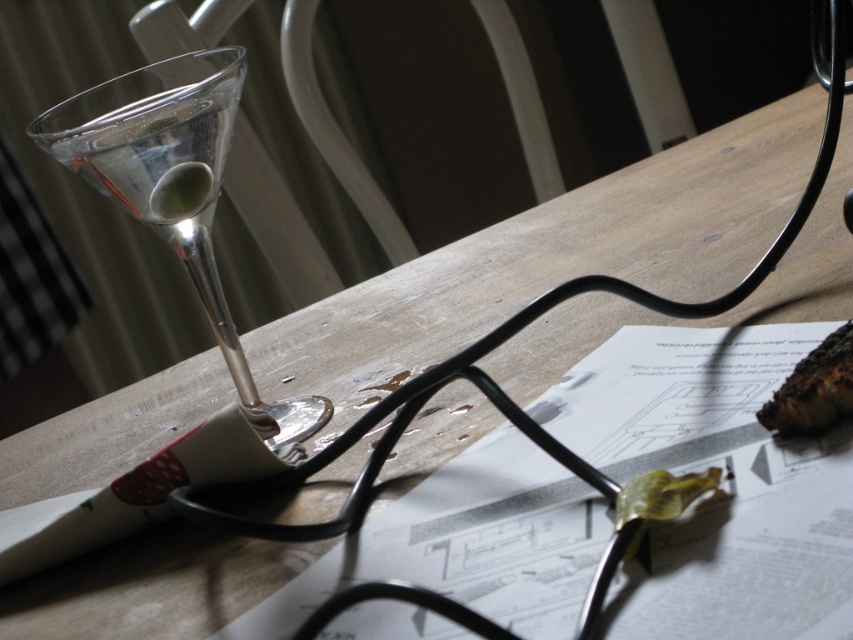
You are a bartender preparing a drink. You have a clear glass martini glass at left and a charcoal black bread at lower right on the table. Which object has a larger diameter?

The clear glass martini glass at left might be wider than charcoal black bread at lower right, so it likely has a larger diameter.

You are organizing items on a wooden table. You need to place a new item between the white paper at center and the charcoal black bread at lower right. Based on their current positions, which object should you place the new item closer to?

The white paper at center is positioned on the left side of charcoal black bread at lower right, so to place the new item between them, you should position it closer to the white paper at center since it is on the left and the bread is on the right.